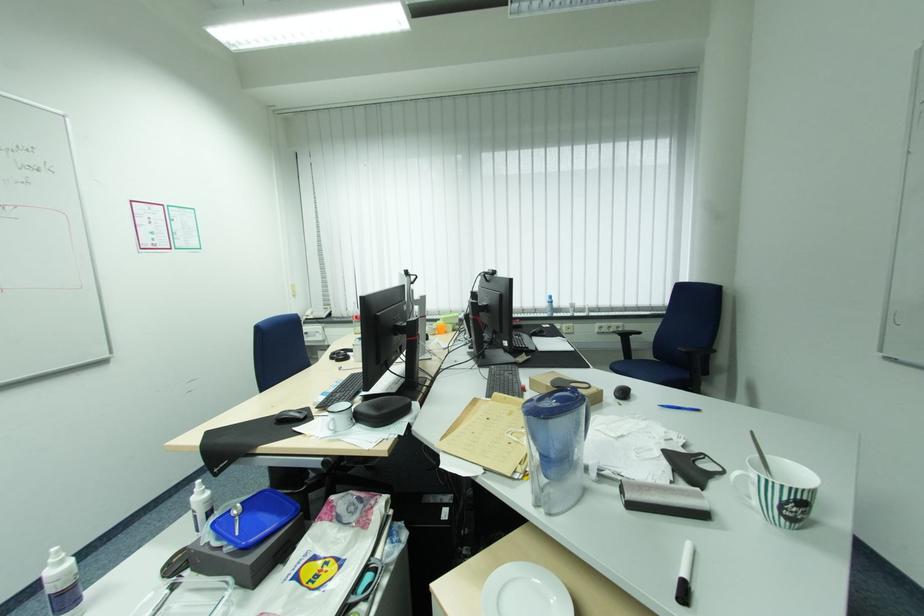
Locate an element on the screen. The height and width of the screenshot is (616, 924). chair armrest is located at coordinates (699, 357).